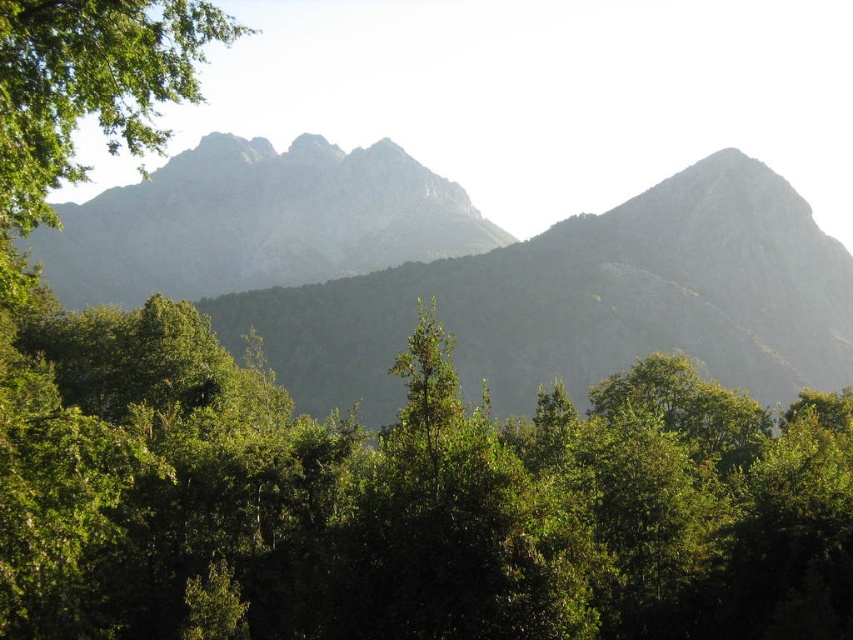
You are an outdoor enthusiast planning a hiking route. You see the gray rocky mountain range at upper center and the gray rocky mountain at center. Which mountain is closer to you?

The gray rocky mountain range at upper center is closer to the viewer than the gray rocky mountain at center.

You are standing in the mountainous landscape and see the point marked at coordinate (399, 499). What does this point represent?

The point at coordinate (399, 499) represents the green leafy tree at center.